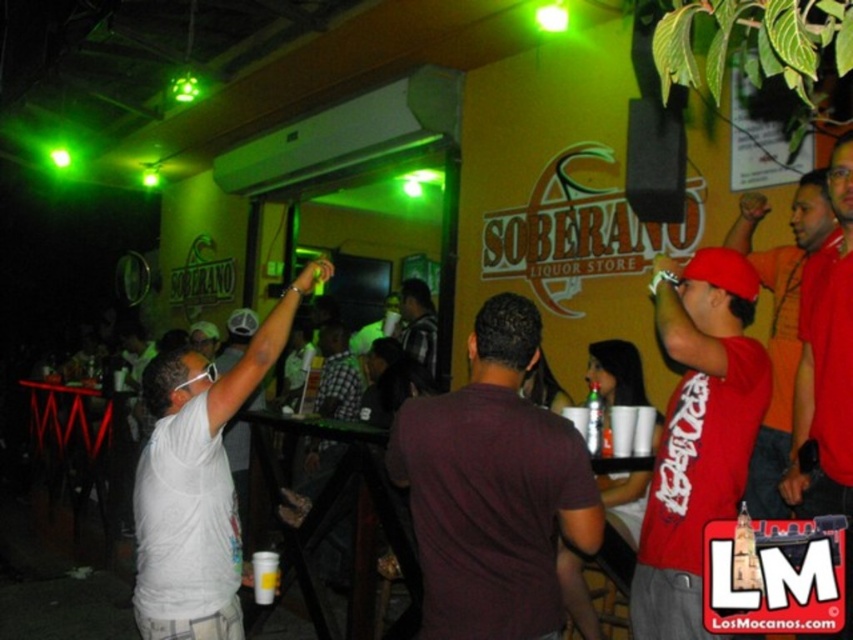
Question: Does red matte shirt at center appear on the right side of red matte shirt at right?

Choices:
 (A) yes
 (B) no

Answer: (B)

Question: Which object appears farthest from the camera in this image?

Choices:
 (A) plaid fabric shirt at center
 (B) clear plastic bottle at center

Answer: (A)

Question: Is white matte t-shirt at center above red matte shirt at right?

Choices:
 (A) yes
 (B) no

Answer: (B)

Question: Which point appears closest to the camera in this image?

Choices:
 (A) (186, 508)
 (B) (596, 412)
 (C) (431, 344)

Answer: (A)

Question: Can you confirm if maroon cotton t-shirt at center is positioned to the left of red matte shirt at center?

Choices:
 (A) yes
 (B) no

Answer: (A)

Question: Which object is the closest to the red matte shirt at right?

Choices:
 (A) red matte shirt at center
 (B) plaid fabric shirt at center

Answer: (A)